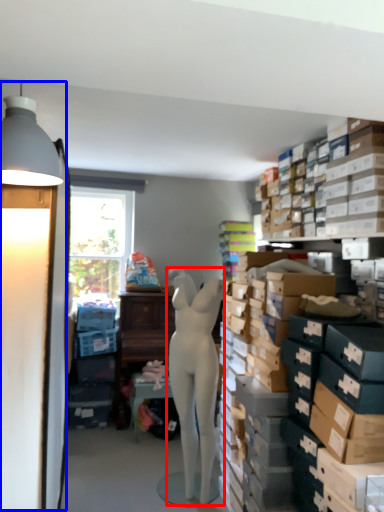
Question: Which object appears closest to the camera in this image, person (highlighted by a red box) or table lamp (highlighted by a blue box)?

Choices:
 (A) person
 (B) table lamp

Answer: (B)